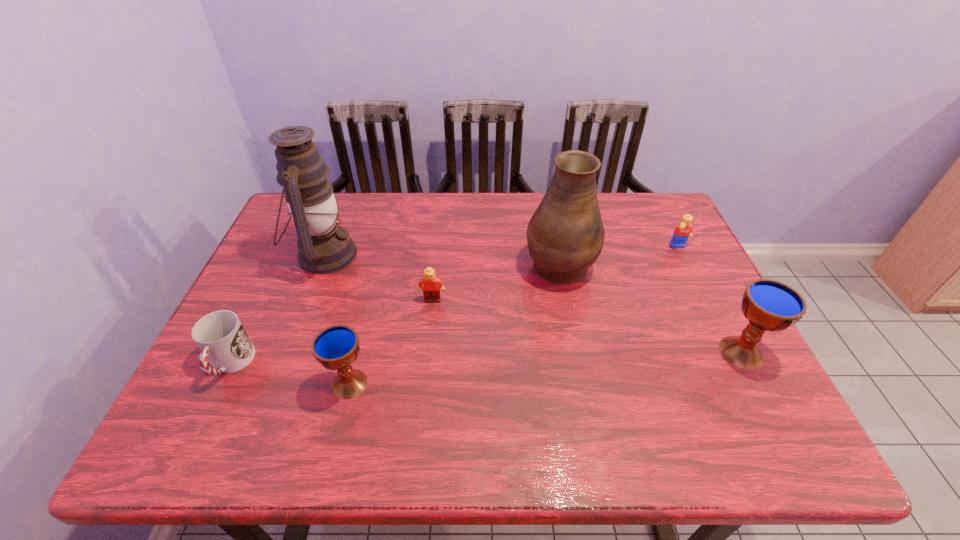
Image resolution: width=960 pixels, height=540 pixels. I want to click on chalice that is at the near edge, so click(x=336, y=347).

The width and height of the screenshot is (960, 540). Identify the location of cup present at the near edge. (223, 341).

Identify the location of oil lamp located at the left edge. (324, 247).

The image size is (960, 540). What are the coordinates of `cup that is at the left edge` in the screenshot? It's located at (223, 341).

Locate an element on the screen. This screenshot has height=540, width=960. chalice at the right edge is located at coordinates (769, 305).

You are a GUI agent. You are given a task and a screenshot of the screen. Output one action in this format:
    pyautogui.click(x=<x>, y=<y>)
    Task: Click on the Lego situated at the right edge
    This screenshot has width=960, height=540.
    Given the screenshot: What is the action you would take?
    point(683,231)

Image resolution: width=960 pixels, height=540 pixels. I want to click on object at the far left corner, so click(324, 247).

Find the location of a particular element. The height and width of the screenshot is (540, 960). object situated at the near left corner is located at coordinates (223, 341).

You are a GUI agent. You are given a task and a screenshot of the screen. Output one action in this format:
    pyautogui.click(x=<x>, y=<y>)
    Task: Click on the vacant space at the far edge of the desktop
    
    Given the screenshot: What is the action you would take?
    pyautogui.click(x=365, y=199)

Find the location of a particular element. vacant space at the near edge is located at coordinates (448, 404).